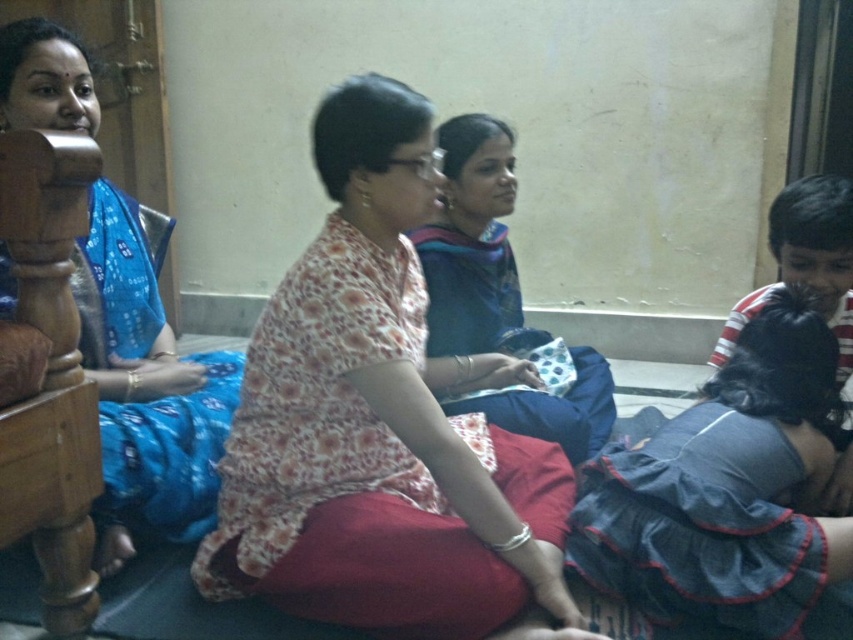
Who is more distant from viewer, [769,356] or [439,246]?

The point [439,246] is behind.

Between dark blue satin sari at lower right and blue fabric saree at center, which one is positioned lower?

dark blue satin sari at lower right is below.

You are a GUI agent. You are given a task and a screenshot of the screen. Output one action in this format:
    pyautogui.click(x=<x>, y=<y>)
    Task: Click on the dark blue satin sari at lower right
    This screenshot has width=853, height=640.
    Given the screenshot: What is the action you would take?
    pyautogui.click(x=726, y=488)

Find the location of a particular element. dark blue satin sari at lower right is located at coordinates (726, 488).

Which is more to the right, floral fabric blouse at center or blue printed saree at left?

From the viewer's perspective, floral fabric blouse at center appears more on the right side.

Is the position of floral fabric blouse at center less distant than that of blue printed saree at left?

Yes, floral fabric blouse at center is in front of blue printed saree at left.

Does point (511, 518) lie in front of point (157, 413)?

That is True.

Locate an element on the screen. This screenshot has height=640, width=853. floral fabric blouse at center is located at coordinates (376, 422).

Looking at this image, does floral fabric blouse at center appear on the left side of blue fabric saree at center?

Correct, you'll find floral fabric blouse at center to the left of blue fabric saree at center.

Describe the element at coordinates (376, 422) in the screenshot. The image size is (853, 640). I see `floral fabric blouse at center` at that location.

Find the location of a particular element. floral fabric blouse at center is located at coordinates (376, 422).